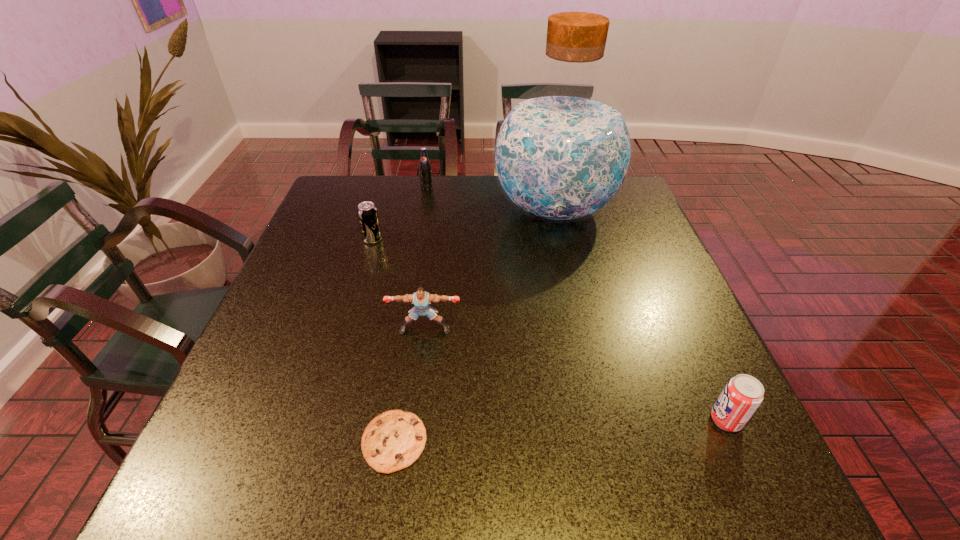
Identify which soda can is located as the nearest to the third nearest object. Please provide its 2D coordinates. Your answer should be formatted as a tuple, i.e. [(x, y)], where the tuple contains the x and y coordinates of a point satisfying the conditions above.

[(367, 212)]

Identify the location of vacant area in the image that satisfies the following two spatial constraints: 1. on the front label of the fifth object from left to right; 2. on the right side of the tallest soda can. Image resolution: width=960 pixels, height=540 pixels. (423, 209).

Where is `vacant region that satisfies the following two spatial constraints: 1. on the front-facing side of the third nearest object; 2. on the left side of the nearest soda can`? This screenshot has width=960, height=540. vacant region that satisfies the following two spatial constraints: 1. on the front-facing side of the third nearest object; 2. on the left side of the nearest soda can is located at coordinates (414, 420).

At what (x,y) coordinates should I click in order to perform the action: click on free location that satisfies the following two spatial constraints: 1. on the front side of the shortest object; 2. on the left side of the leftmost soda can. Please return your answer as a coordinate pair (x, y). This screenshot has height=540, width=960. Looking at the image, I should click on (313, 442).

Identify the location of vacant space that satisfies the following two spatial constraints: 1. on the front side of the second object from right to left; 2. on the right side of the rightmost soda can. The image size is (960, 540). (602, 420).

Locate an element on the screen. This screenshot has width=960, height=540. free space that satisfies the following two spatial constraints: 1. on the front label of the second soda can from right to left; 2. on the left side of the tallest object is located at coordinates (423, 209).